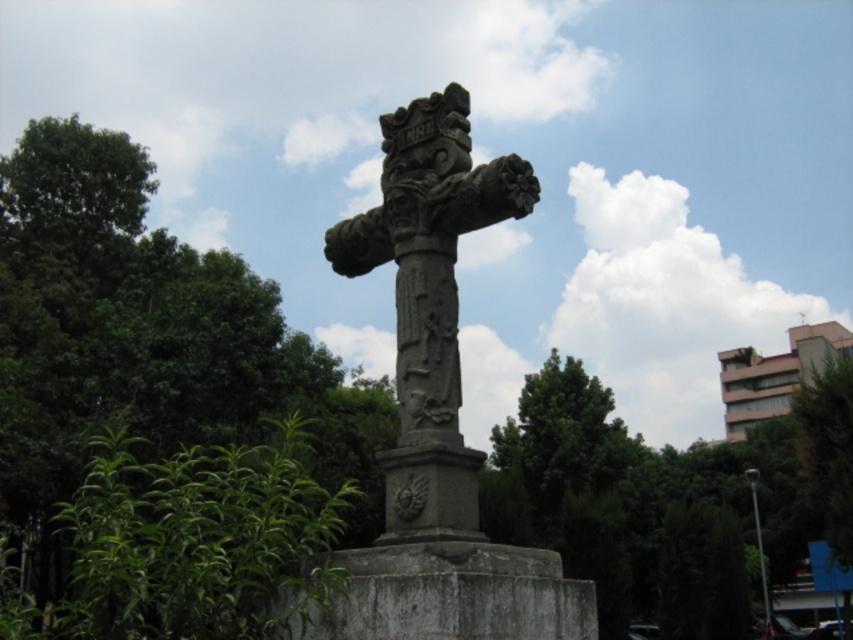
You are an architect designing a new garden layout and need to know the relative sizes of the green leafy tree at upper left and the gray stone cross at center. Which one has a greater width?

The green leafy tree at upper left has a greater width than the gray stone cross at center according to the description.

You are standing facing the gray stone cross at center in the park. Which direction should you turn to see the green leafy tree at upper left?

The green leafy tree at upper left is to the left of the gray stone cross at center, so you should turn to your left to see it.